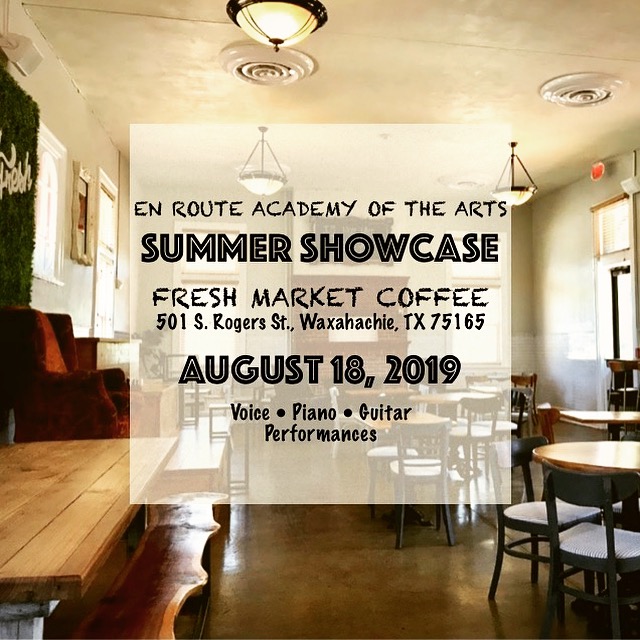
Identify the location of lights. (280, 13), (523, 192), (266, 185).